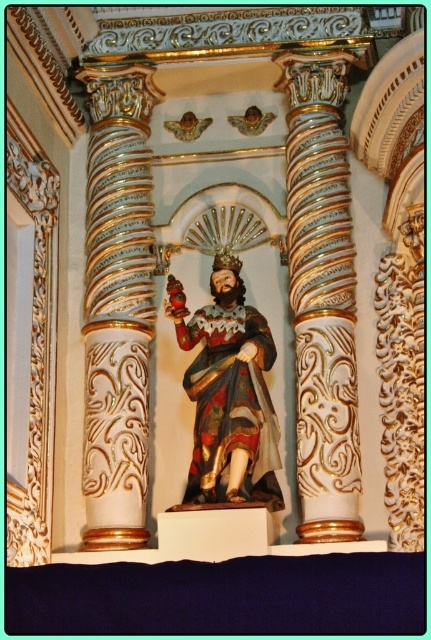
Question: Does white glossy column at center appear on the right side of wooden statue at center?

Choices:
 (A) no
 (B) yes

Answer: (B)

Question: Among these points, which one is nearest to the camera?

Choices:
 (A) (137, 413)
 (B) (237, 429)

Answer: (B)

Question: Does white glossy column at center have a lesser width compared to wooden statue at center?

Choices:
 (A) yes
 (B) no

Answer: (A)

Question: Which of these objects is positioned farthest from the white glossy column at center?

Choices:
 (A) wooden statue at center
 (B) white glossy column at left

Answer: (B)

Question: Can you confirm if white glossy column at left is positioned below white glossy column at center?

Choices:
 (A) no
 (B) yes

Answer: (B)

Question: Which object is the farthest from the white glossy column at left?

Choices:
 (A) wooden statue at center
 (B) white glossy column at center

Answer: (B)